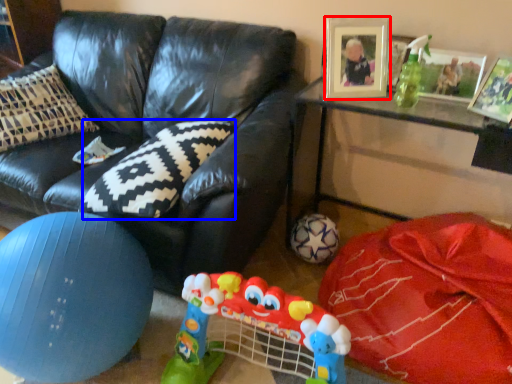
Question: Which object appears closest to the camera in this image, picture frame (highlighted by a red box) or pillow (highlighted by a blue box)?

Choices:
 (A) picture frame
 (B) pillow

Answer: (B)